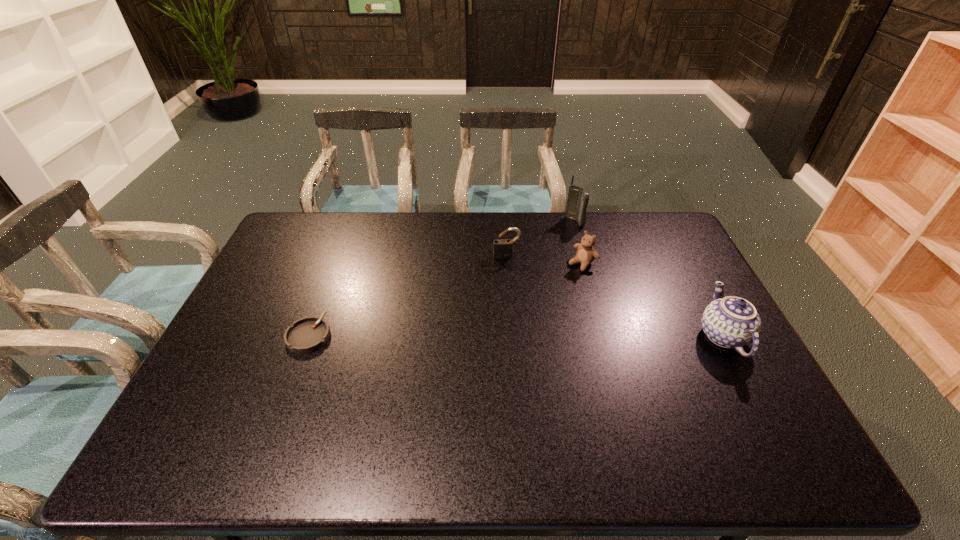
Where is `vacant region at the far edge`? vacant region at the far edge is located at coordinates (423, 228).

Locate an element on the screen. The image size is (960, 540). free point at the near edge is located at coordinates (574, 423).

Locate an element on the screen. vacant space at the left edge is located at coordinates (281, 253).

In the image, there is a desktop. Where is `free space at the right edge`? free space at the right edge is located at coordinates (732, 388).

Where is `free location at the far left corner`? The height and width of the screenshot is (540, 960). free location at the far left corner is located at coordinates (303, 240).

Where is `free region at the near left corner of the desktop`? free region at the near left corner of the desktop is located at coordinates (219, 403).

Find the location of a particular element. This screenshot has height=540, width=960. vacant space at the near right corner of the desktop is located at coordinates (738, 414).

Where is `vacant area between the tallest object and the teddy bear`? Image resolution: width=960 pixels, height=540 pixels. vacant area between the tallest object and the teddy bear is located at coordinates (578, 242).

Identify the location of vacant area that lies between the shortest object and the fourth shortest object. (516, 336).

I want to click on empty location between the leftmost object and the cellular telephone, so click(x=442, y=279).